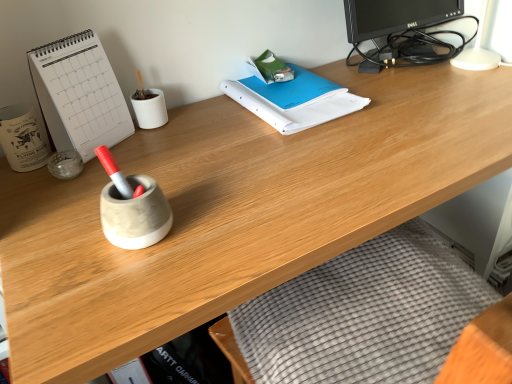
This screenshot has width=512, height=384. What are the coordinates of `blank space situated above blue paper binder at center (from a real-world perspective)` in the screenshot? It's located at (287, 88).